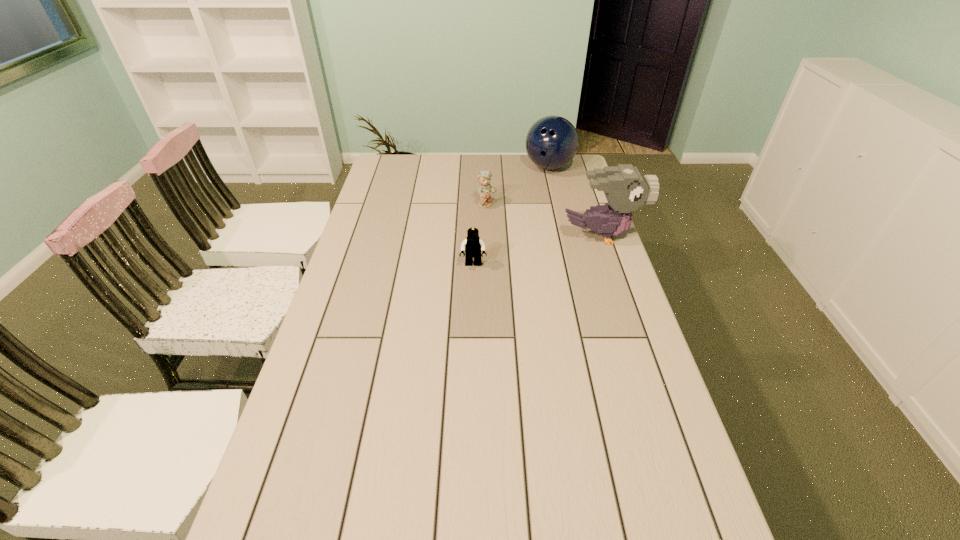
Find the location of `free space between the teddy bear and the third farthest object`. free space between the teddy bear and the third farthest object is located at coordinates (544, 220).

Locate an element on the screen. blank region between the nearest object and the second farthest object is located at coordinates (480, 234).

The width and height of the screenshot is (960, 540). I want to click on free spot between the teddy bear and the second nearest object, so click(544, 220).

Where is `vacant space in between the bowling ball and the second farthest object`? vacant space in between the bowling ball and the second farthest object is located at coordinates (518, 186).

Where is `free space between the third nearest object and the farthest object`? This screenshot has height=540, width=960. free space between the third nearest object and the farthest object is located at coordinates (518, 186).

This screenshot has height=540, width=960. I want to click on vacant area that lies between the bowling ball and the bird, so click(575, 201).

Locate an element on the screen. The image size is (960, 540). vacant space that's between the bird and the nearest object is located at coordinates (537, 251).

Find the location of a particular element. The height and width of the screenshot is (540, 960). unoccupied position between the Lego and the third nearest object is located at coordinates 480,234.

Find the location of a particular element. The image size is (960, 540). object that can be found as the third closest to the bird is located at coordinates (551, 143).

Identify which object is the second closest to the farthest object. Please provide its 2D coordinates. Your answer should be formatted as a tuple, i.e. [(x, y)], where the tuple contains the x and y coordinates of a point satisfying the conditions above.

[(626, 189)]